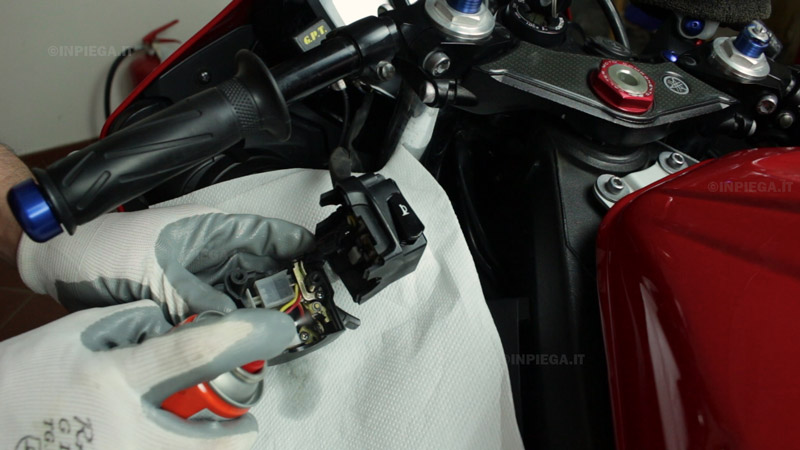
Identify the location of black handle. The image size is (800, 450). (124, 165).